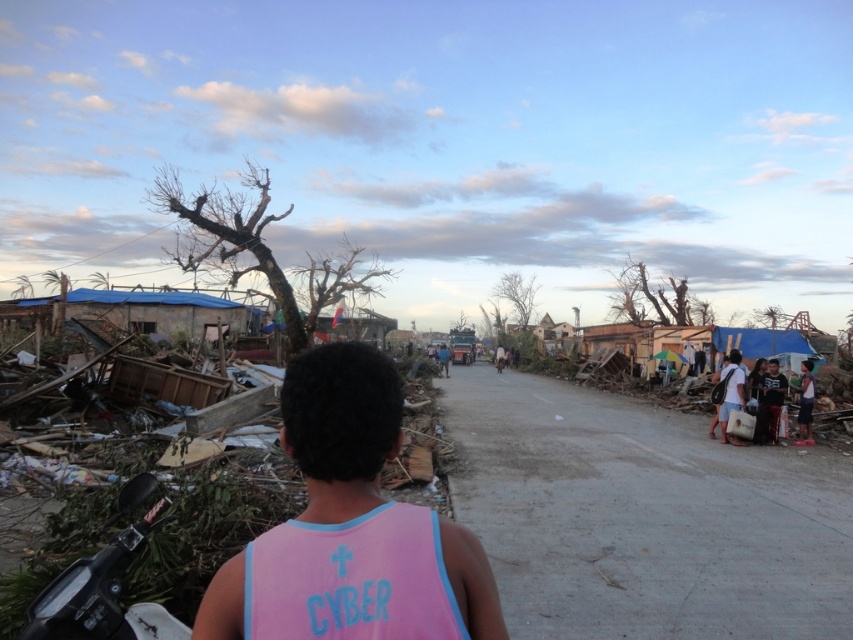
Does dark gray shirt at right come in front of matte white bag at right?

No.

Between point (773, 432) and point (729, 400), which one is positioned behind?

The point (773, 432) is behind.

Is point (770, 365) positioned before point (735, 403)?

No.

Locate an element on the screen. The width and height of the screenshot is (853, 640). dark gray shirt at right is located at coordinates [770, 401].

Does brown bark tree at center appear under dark gray shirt at right?

Incorrect, brown bark tree at center is not positioned below dark gray shirt at right.

Between point (212, 262) and point (759, 412), which one is positioned behind?

The point (212, 262) is behind.

This screenshot has height=640, width=853. Identify the location of brown bark tree at center. (257, 248).

Where is `bare wood tree at upper center`? The width and height of the screenshot is (853, 640). bare wood tree at upper center is located at coordinates (648, 296).

Does point (647, 288) come behind point (740, 388)?

Yes.

At what (x,y) coordinates should I click in order to perform the action: click on bare wood tree at upper center. Please return your answer as a coordinate pair (x, y). The image size is (853, 640). Looking at the image, I should click on (648, 296).